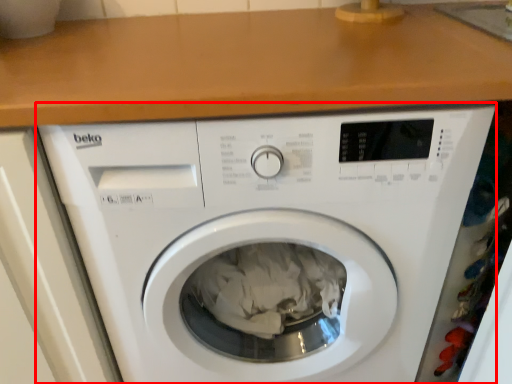
Question: From the image's perspective, what is the correct spatial positioning of washing machine (annotated by the red box) in reference to counter top?

Choices:
 (A) below
 (B) above

Answer: (A)